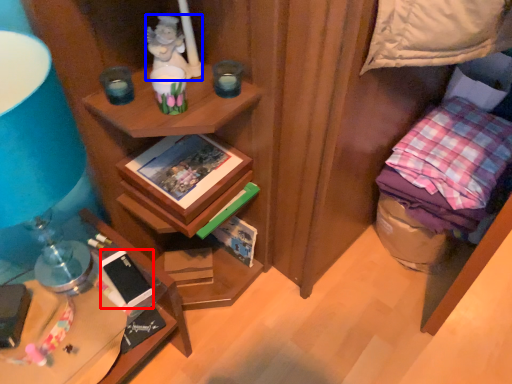
Question: Which object appears closest to the camera in this image, mobile phone (highlighted by a red box) or person (highlighted by a blue box)?

Choices:
 (A) mobile phone
 (B) person

Answer: (B)